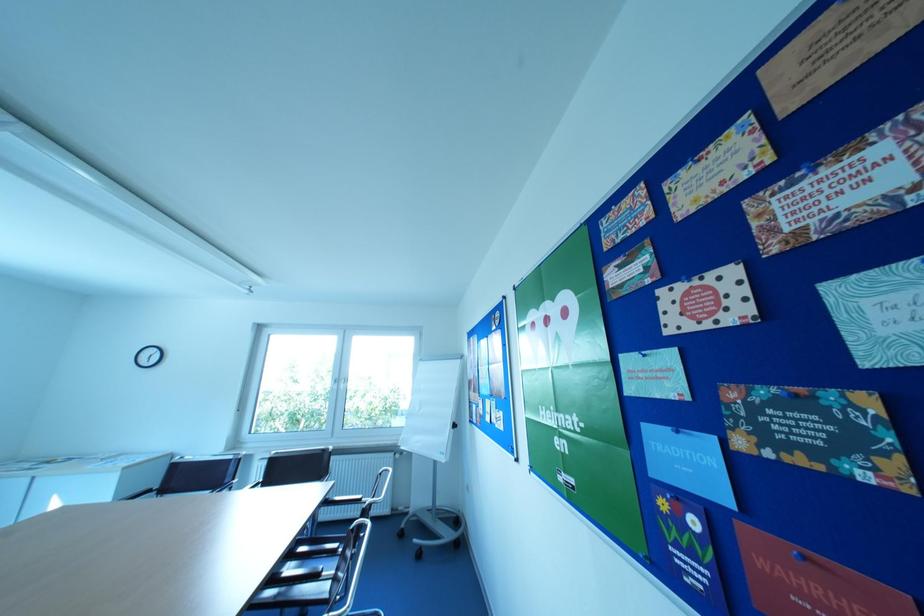
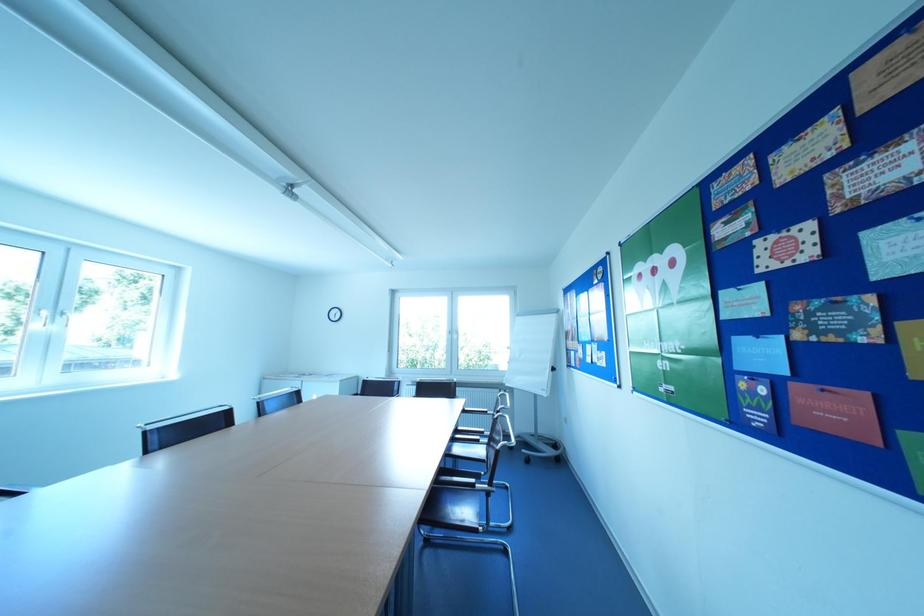
Question: The camera is either moving clockwise (left) or counter-clockwise (right) around the object. The first image is from the beginning of the video and the second image is from the end. Is the camera moving left or right when shooting the video?

Choices:
 (A) Left
 (B) Right

Answer: (B)